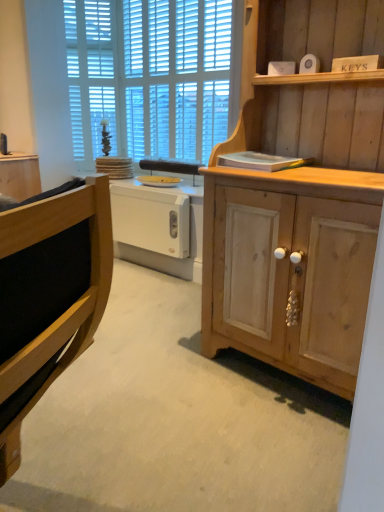
The image size is (384, 512). Identify the location of vacant space underneath natural wood cabinet at right, the 1th cabinetry when ordered from front to back (from a real-world perspective). (274, 379).